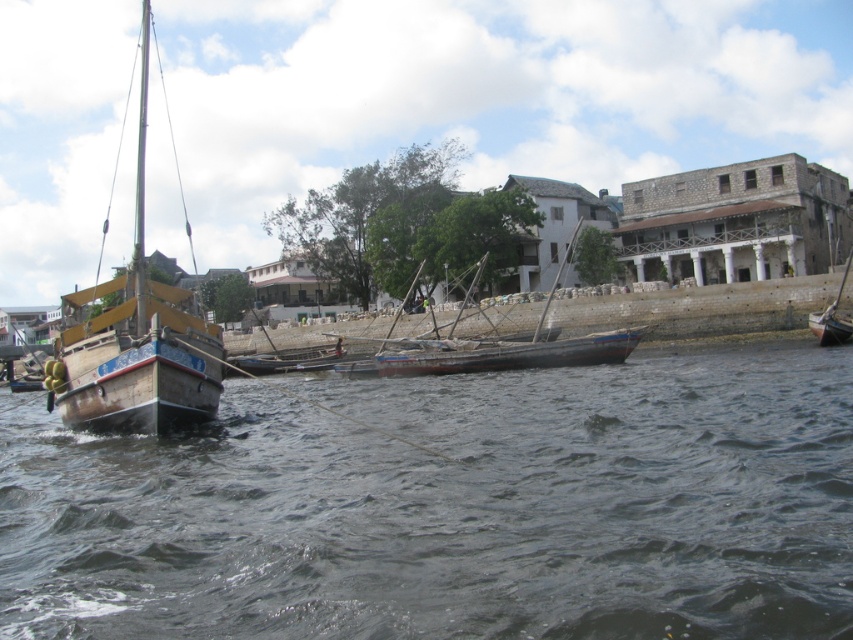
Where is `wooden boat at center`? This screenshot has height=640, width=853. wooden boat at center is located at coordinates pyautogui.click(x=502, y=348).

The image size is (853, 640). In order to click on wooden boat at center in this screenshot , I will do `click(502, 348)`.

Who is lower down, dark gray water at center or wooden boat at center?

dark gray water at center is lower down.

Based on the photo, is dark gray water at center smaller than wooden boat at center?

Yes, dark gray water at center is smaller than wooden boat at center.

Is point (614, 564) closer to viewer compared to point (405, 372)?

Yes, it is.

The image size is (853, 640). In order to click on dark gray water at center in this screenshot , I will do `click(450, 508)`.

Who is more forward, (71, 413) or (840, 324)?

Point (71, 413) is more forward.

Does wooden sailboat at left appear over wooden boat at right?

Indeed, wooden sailboat at left is positioned over wooden boat at right.

Measure the distance between wooden sailboat at left and camera.

wooden sailboat at left is 53.24 feet away from camera.

This screenshot has height=640, width=853. I want to click on wooden sailboat at left, so click(136, 340).